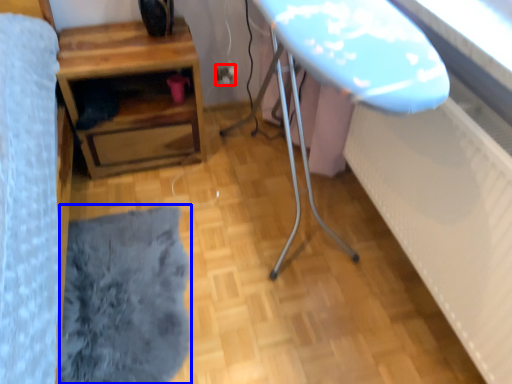
Question: Which object is closer to the camera taking this photo, electric outlet (highlighted by a red box) or flat (highlighted by a blue box)?

Choices:
 (A) electric outlet
 (B) flat

Answer: (B)